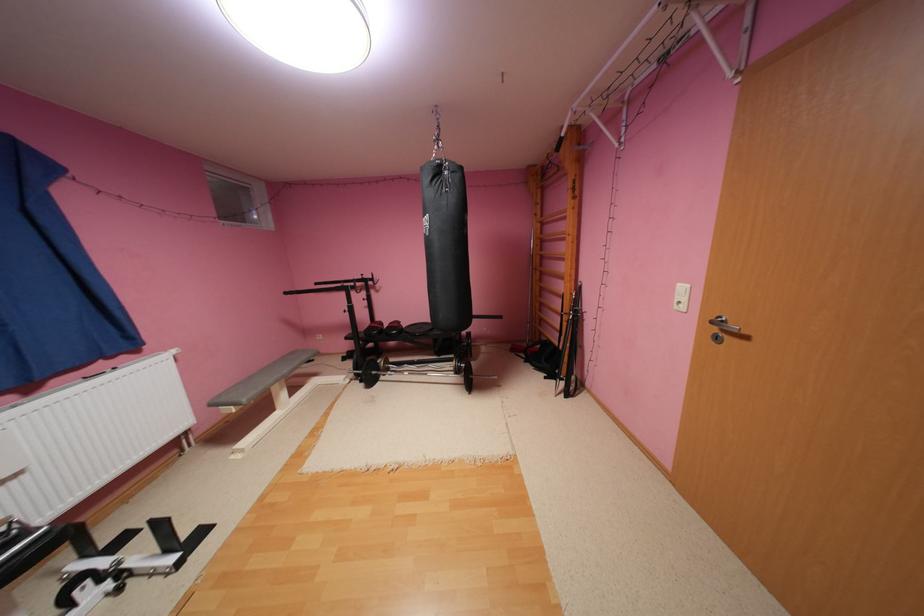
Locate an element on the screen. Image resolution: width=924 pixels, height=616 pixels. white pull-up bar is located at coordinates (91, 434).